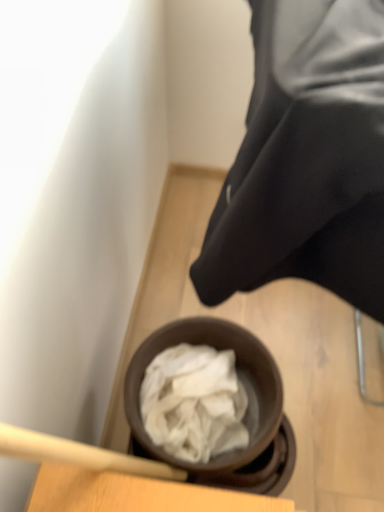
This screenshot has height=512, width=384. What do you see at coordinates (306, 159) in the screenshot?
I see `black satin shirt at upper right` at bounding box center [306, 159].

Measure the distance between black satin shirt at upper right and camera.

The depth of black satin shirt at upper right is 18.64 inches.

Find the location of a particular element. This screenshot has width=384, height=512. black satin shirt at upper right is located at coordinates (306, 159).

Find the location of a particular element. This screenshot has height=512, width=384. black satin shirt at upper right is located at coordinates (306, 159).